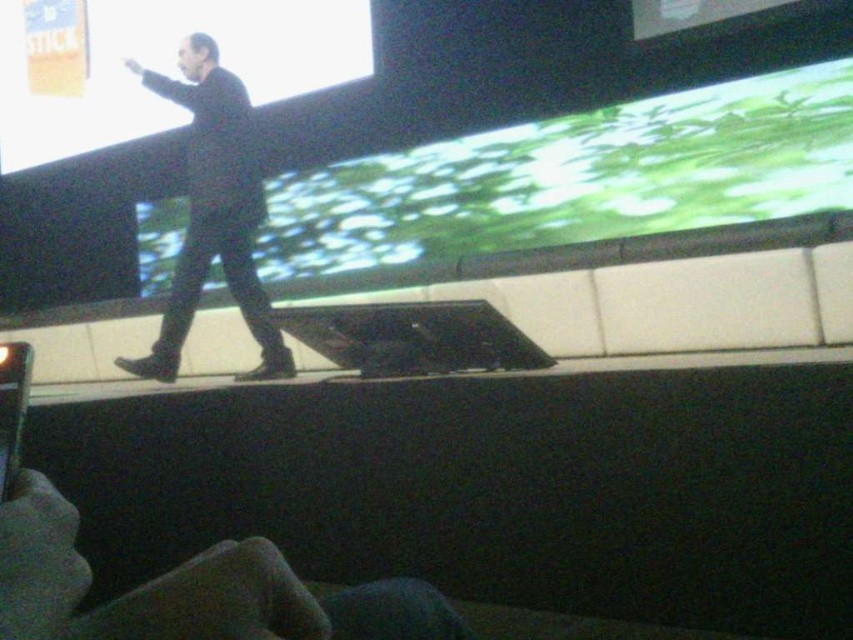
Question: Can you confirm if green matte projection screen at upper center is bigger than black matte suit at center?

Choices:
 (A) no
 (B) yes

Answer: (B)

Question: Which point is farther to the camera?

Choices:
 (A) green matte projection screen at upper center
 (B) matte black screen at upper center

Answer: (B)

Question: Is green matte projection screen at upper center thinner than black matte suit at center?

Choices:
 (A) no
 (B) yes

Answer: (A)

Question: Does green matte projection screen at upper center have a lesser width compared to matte black screen at upper center?

Choices:
 (A) no
 (B) yes

Answer: (B)

Question: Which of these objects is positioned farthest from the matte black screen at upper center?

Choices:
 (A) black matte suit at center
 (B) green matte projection screen at upper center

Answer: (B)

Question: Which point appears farthest from the camera in this image?

Choices:
 (A) pos(148,65)
 (B) pos(231,77)
 (C) pos(561,189)

Answer: (A)